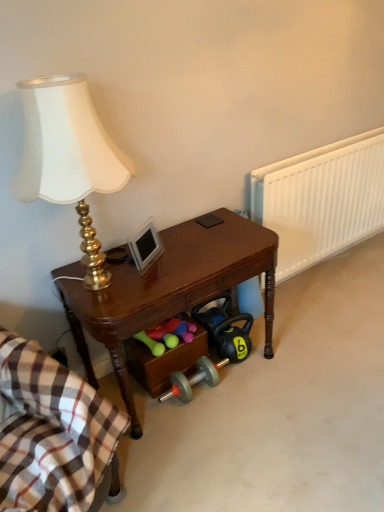
This screenshot has height=512, width=384. I want to click on free spot above wooden drawer at lower center (from a real-world perspective), so click(x=173, y=336).